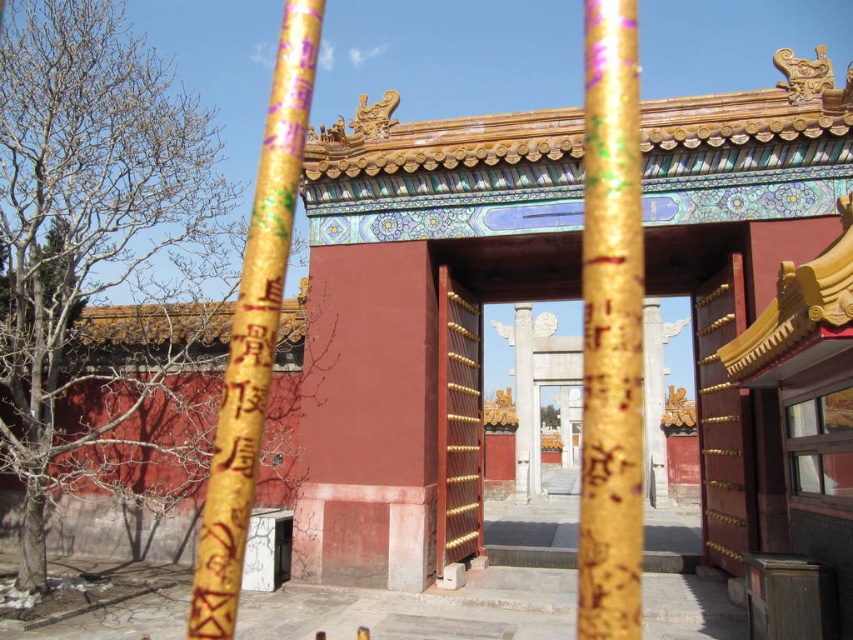
You are standing in the courtyard of a traditional Chinese temple. You see a gold glittering pole at center. If your camera is 1.5 meters tall, will you be able to capture the entire pole in your photo without moving the camera?

The gold glittering pole at center and camera are 12.95 meters apart. Since the camera is 1.5 meters tall, the distance is sufficient to capture the entire pole in the photo without needing to move the camera.

You are a tour guide leading a group through this traditional Chinese architectural complex. You need to ensure that a 3.5 meter long banner can be stretched between the gold glittering pole at center and the smooth wood gate at center without bending. Can this banner be properly displayed between them?

The gold glittering pole at center and smooth wood gate at center are 3.19 meters apart. Since the banner is 3.5 meters long, it is longer than the distance between the two objects. Stretching it fully would cause the banner to sag or bend. To display it properly without bending, the banner should be shorter than or equal to the distance between the two points. Therefore, the 3.5 meter banner cannot be stretched fully between them without bending.

You are standing in front of the traditional Chinese structure and want to enter through the smooth wood gate at center. Is the gold glittering pole at center blocking your path to the gate?

The gold glittering pole at center is in front of the smooth wood gate at center, so it is blocking the path to the gate.